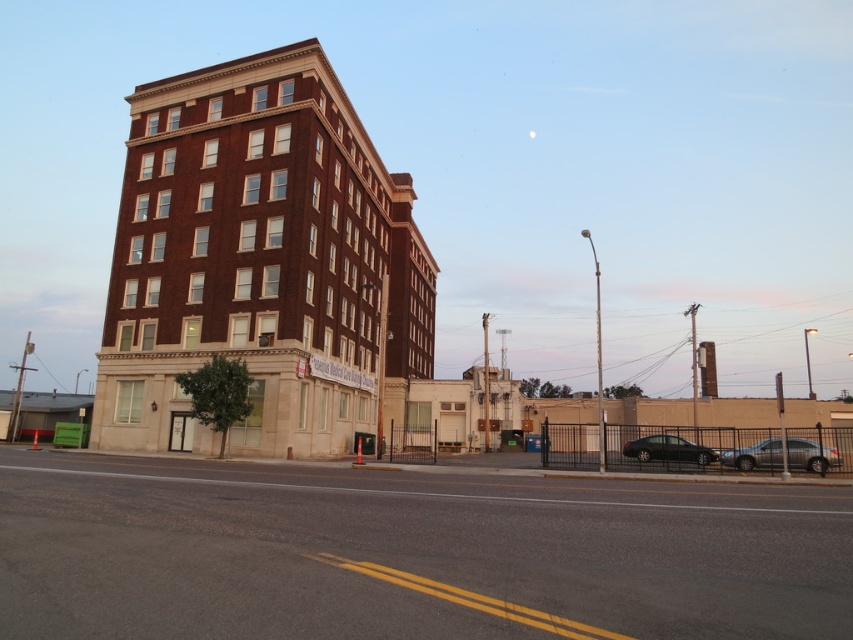
Is satin silver sedan at lower right thinner than black glossy sedan at lower right?

Indeed, satin silver sedan at lower right has a lesser width compared to black glossy sedan at lower right.

Who is positioned more to the right, satin silver sedan at lower right or black glossy sedan at lower right?

satin silver sedan at lower right is more to the right.

The image size is (853, 640). Find the location of `satin silver sedan at lower right`. satin silver sedan at lower right is located at coordinates (755, 456).